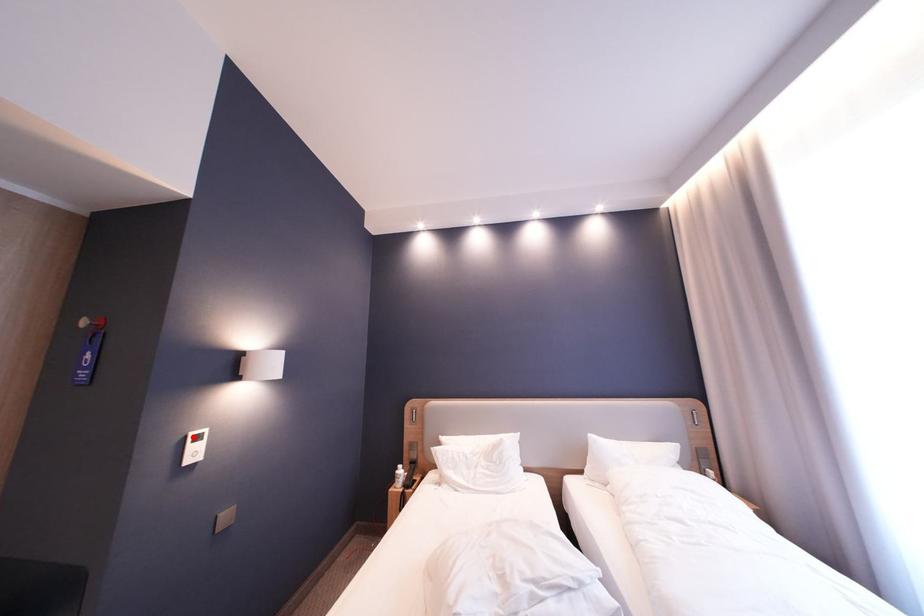
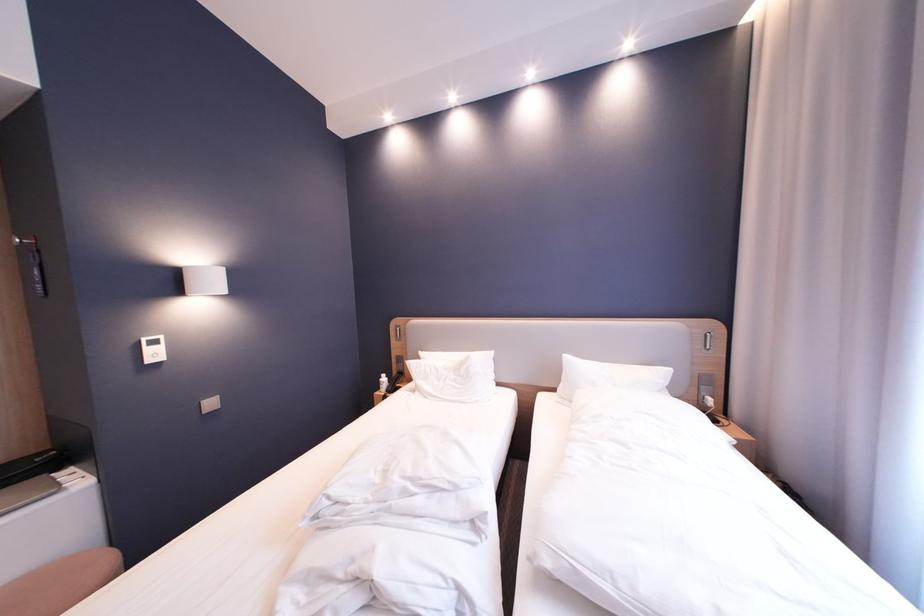
The point at the highlighted location is marked in the first image. Where is the corresponding point in the second image?

(148, 341)